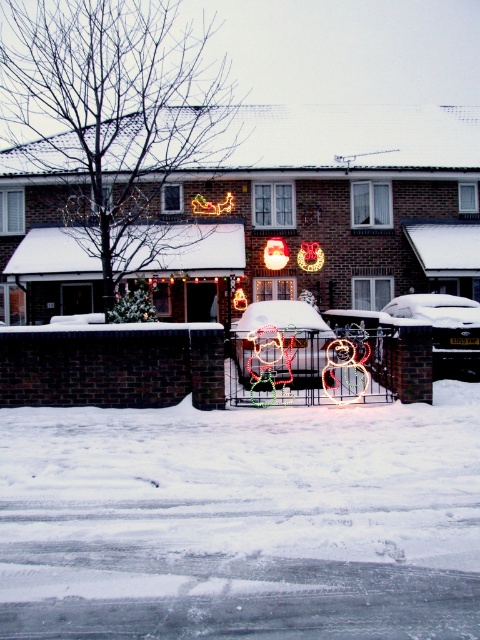
Question: Does white fluffy snow at lower center have a greater width compared to snow-covered car at center?

Choices:
 (A) yes
 (B) no

Answer: (B)

Question: Is white fluffy snow at lower center positioned behind snow-covered car at center?

Choices:
 (A) yes
 (B) no

Answer: (B)

Question: Which of the following is the closest to the observer?

Choices:
 (A) snow-covered car at center
 (B) neon santa at center

Answer: (B)

Question: Which point is farther to the camera?

Choices:
 (A) (132, 518)
 (B) (464, 340)
 (C) (300, 305)

Answer: (C)

Question: Which of the following is the farthest from the observer?

Choices:
 (A) white fluffy snow at lower center
 (B) snow-covered car at center

Answer: (B)

Question: Does white fluffy snow at lower center appear under neon santa at center?

Choices:
 (A) no
 (B) yes

Answer: (B)